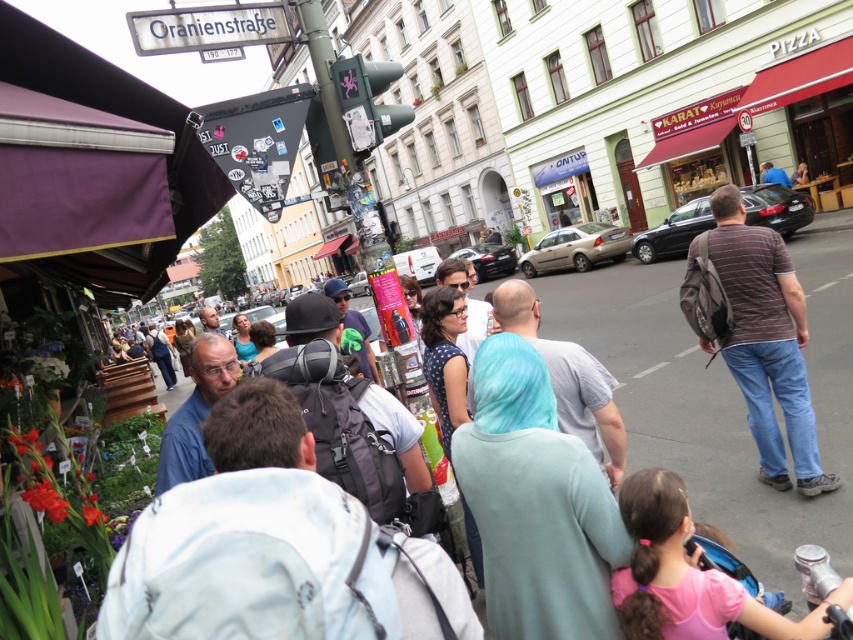
Is purple fabric canopy at upper left wider than striped cotton shirt at center?

Indeed, purple fabric canopy at upper left has a greater width compared to striped cotton shirt at center.

Is point (96, 198) positioned after point (724, 209)?

No, it is in front of (724, 209).

Which is in front, point (112, 240) or point (787, 397)?

Positioned in front is point (112, 240).

Locate an element on the screen. The height and width of the screenshot is (640, 853). purple fabric canopy at upper left is located at coordinates (91, 172).